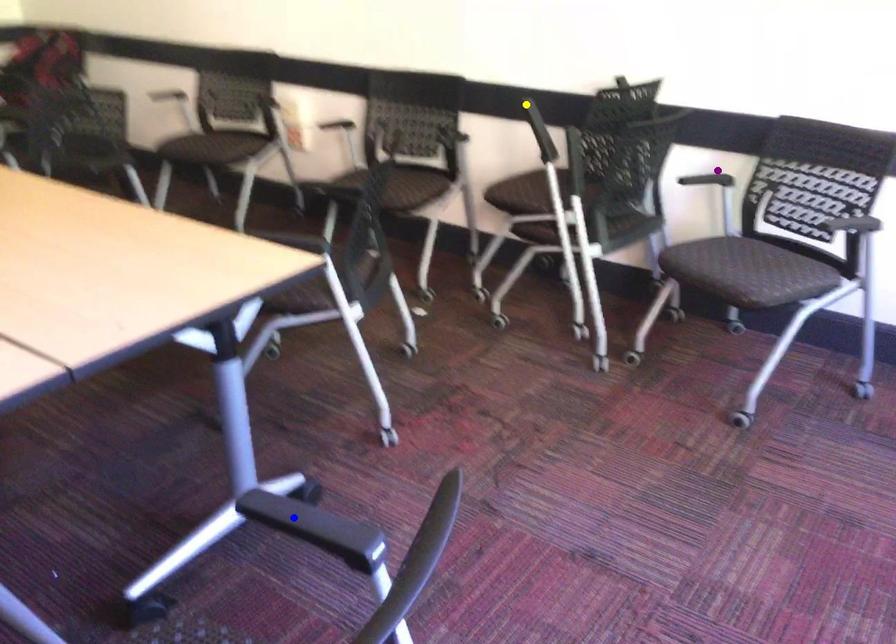
Order these from nearest to farthest:
1. yellow point
2. purple point
3. blue point

blue point → purple point → yellow point